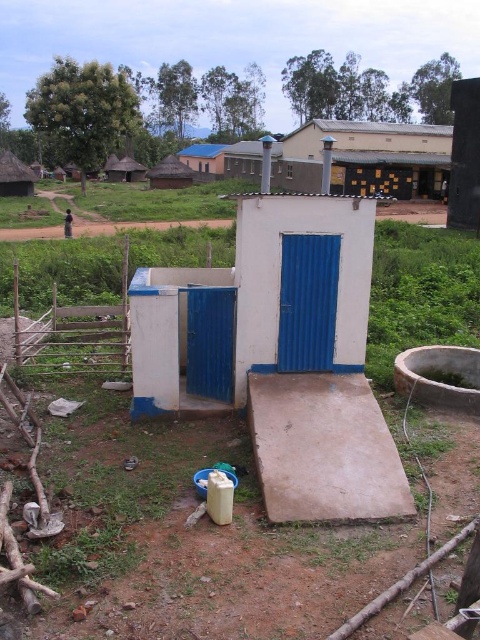
You are a traveler who needs to decide between two huts for shelter. The dark brown wooden hut at upper center and the thatched straw hut at left are both available. Which one offers more space inside based on their widths?

The dark brown wooden hut at upper center has a greater width than the thatched straw hut at left, so it likely offers more space inside.

You are standing in front of the public toilet and want to take a photo of both thatched straw hut at left and thatched straw hut at upper left. Which one will appear larger in the photo?

The thatched straw hut at left will appear larger in the photo because it is much taller than the thatched straw hut at upper left.